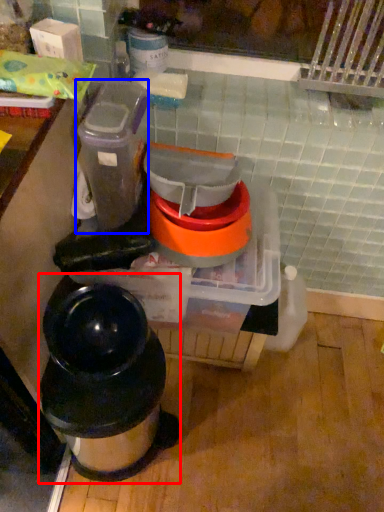
Question: Which object is closer to the camera taking this photo, waste container (highlighted by a red box) or appliance (highlighted by a blue box)?

Choices:
 (A) waste container
 (B) appliance

Answer: (B)